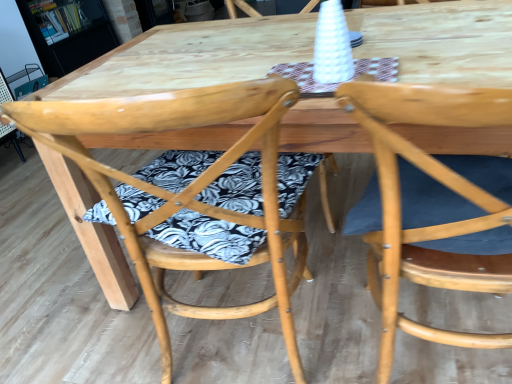
What do you see at coordinates (67, 32) in the screenshot?
I see `wooden bookshelf at upper left` at bounding box center [67, 32].

Find the location of a particular element. natural wood chair at center, the 2th chair viewed from the right is located at coordinates (185, 188).

Can you confirm if natural wood chair at center, placed as the first chair when sorted from left to right, is shorter than wooden bookshelf at upper left?

Incorrect, the height of natural wood chair at center, placed as the first chair when sorted from left to right, does not fall short of that of wooden bookshelf at upper left.

Is the position of natural wood chair at center, placed as the first chair when sorted from left to right, less distant than that of wooden bookshelf at upper left?

Yes, natural wood chair at center, placed as the first chair when sorted from left to right, is closer to the camera.

Is point (195, 92) positioned after point (64, 44)?

No, (195, 92) is in front of (64, 44).

Can you confirm if natural wood chair at center, placed as the first chair when sorted from left to right, is positioned to the right of wooden bookshelf at upper left?

Indeed, natural wood chair at center, placed as the first chair when sorted from left to right, is positioned on the right side of wooden bookshelf at upper left.

From a real-world perspective, is natural wood chair at right, marked as the second chair in a left-to-right arrangement, on top of wooden bookshelf at upper left?

Actually, natural wood chair at right, marked as the second chair in a left-to-right arrangement, is physically below wooden bookshelf at upper left in the real world.

Would you say natural wood chair at right, marked as the second chair in a left-to-right arrangement, is outside wooden bookshelf at upper left?

natural wood chair at right, marked as the second chair in a left-to-right arrangement, is positioned outside wooden bookshelf at upper left.

What's the angular difference between natural wood chair at right, marked as the second chair in a left-to-right arrangement, and wooden bookshelf at upper left's facing directions?

They differ by 90.1 degrees in their facing directions.

Is wooden bookshelf at upper left oriented away from natural wood chair at right, acting as the first chair starting from the right?

wooden bookshelf at upper left is not turned away from natural wood chair at right, acting as the first chair starting from the right.

Between wooden bookshelf at upper left and natural wood chair at right, marked as the second chair in a left-to-right arrangement, which one has smaller size?

natural wood chair at right, marked as the second chair in a left-to-right arrangement, is smaller.

Would you consider wooden bookshelf at upper left to be distant from natural wood chair at right, marked as the second chair in a left-to-right arrangement?

Yes, wooden bookshelf at upper left is far from natural wood chair at right, marked as the second chair in a left-to-right arrangement.

Which object is positioned more to the right, wooden bookshelf at upper left or natural wood chair at right, acting as the first chair starting from the right?

natural wood chair at right, acting as the first chair starting from the right.

In the scene shown: How much distance is there between natural wood chair at center, the 2th chair viewed from the right, and natural wood chair at right, marked as the second chair in a left-to-right arrangement?

natural wood chair at center, the 2th chair viewed from the right, is 11.77 inches from natural wood chair at right, marked as the second chair in a left-to-right arrangement.

Is natural wood chair at center, the 2th chair viewed from the right, thinner than natural wood chair at right, acting as the first chair starting from the right?

No.

Considering the relative sizes of natural wood chair at center, placed as the first chair when sorted from left to right, and natural wood chair at right, acting as the first chair starting from the right, in the image provided, is natural wood chair at center, placed as the first chair when sorted from left to right, shorter than natural wood chair at right, acting as the first chair starting from the right,?

Incorrect, the height of natural wood chair at center, placed as the first chair when sorted from left to right, does not fall short of that of natural wood chair at right, acting as the first chair starting from the right.

Is natural wood chair at center, placed as the first chair when sorted from left to right, turned away from natural wood chair at right, acting as the first chair starting from the right?

No, natural wood chair at center, placed as the first chair when sorted from left to right, is not facing away from natural wood chair at right, acting as the first chair starting from the right.

From the image's perspective, who appears lower, wooden bookshelf at upper left or natural wood chair at center, the 2th chair viewed from the right?

natural wood chair at center, the 2th chair viewed from the right, is shown below in the image.

Is wooden bookshelf at upper left spatially inside natural wood chair at center, the 2th chair viewed from the right, or outside of it?

wooden bookshelf at upper left is not inside natural wood chair at center, the 2th chair viewed from the right, it's outside.

Can you see natural wood chair at right, marked as the second chair in a left-to-right arrangement, touching natural wood chair at center, placed as the first chair when sorted from left to right?

No, natural wood chair at right, marked as the second chair in a left-to-right arrangement, is not making contact with natural wood chair at center, placed as the first chair when sorted from left to right.

Is natural wood chair at right, acting as the first chair starting from the right, behind natural wood chair at center, the 2th chair viewed from the right?

No, natural wood chair at right, acting as the first chair starting from the right, is closer to the camera.

From a real-world perspective, relative to natural wood chair at center, the 2th chair viewed from the right, is natural wood chair at right, marked as the second chair in a left-to-right arrangement, vertically above or below?

In terms of real-world spatial position, natural wood chair at right, marked as the second chair in a left-to-right arrangement, is below natural wood chair at center, the 2th chair viewed from the right.

Locate an element on the screen. Image resolution: width=512 pixels, height=384 pixels. the 1st chair to the right of the wooden bookshelf at upper left, starting your count from the anchor is located at coordinates (185, 188).

Locate an element on the screen. the 2nd chair in front of the wooden bookshelf at upper left, starting your count from the anchor is located at coordinates (432, 205).

When comparing their distances from wooden bookshelf at upper left, does natural wood chair at center, the 2th chair viewed from the right, or natural wood chair at right, acting as the first chair starting from the right, seem closer?

natural wood chair at center, the 2th chair viewed from the right.

In the scene shown: From the image, which object appears to be nearer to natural wood chair at right, acting as the first chair starting from the right, natural wood chair at center, the 2th chair viewed from the right, or wooden bookshelf at upper left?

natural wood chair at center, the 2th chair viewed from the right, lies closer to natural wood chair at right, acting as the first chair starting from the right, than the other object.

Considering their positions, is wooden bookshelf at upper left positioned further to natural wood chair at center, the 2th chair viewed from the right, than natural wood chair at right, marked as the second chair in a left-to-right arrangement?

wooden bookshelf at upper left is positioned further to the anchor natural wood chair at center, the 2th chair viewed from the right.

From the image, which object appears to be farther from natural wood chair at center, the 2th chair viewed from the right, natural wood chair at right, marked as the second chair in a left-to-right arrangement, or wooden bookshelf at upper left?

The object further to natural wood chair at center, the 2th chair viewed from the right, is wooden bookshelf at upper left.

Consider the image. Considering their positions, is wooden bookshelf at upper left positioned closer to natural wood chair at right, acting as the first chair starting from the right, than natural wood chair at center, placed as the first chair when sorted from left to right?

natural wood chair at center, placed as the first chair when sorted from left to right, is closer to natural wood chair at right, acting as the first chair starting from the right.

Considering their positions, is natural wood chair at right, acting as the first chair starting from the right, positioned further to wooden bookshelf at upper left than natural wood chair at center, placed as the first chair when sorted from left to right?

natural wood chair at right, acting as the first chair starting from the right, lies further to wooden bookshelf at upper left than the other object.

Find the location of `chair located between natural wood chair at right, marked as the second chair in a left-to-right arrangement, and wooden bookshelf at upper left in the depth direction`. chair located between natural wood chair at right, marked as the second chair in a left-to-right arrangement, and wooden bookshelf at upper left in the depth direction is located at coordinates 185,188.